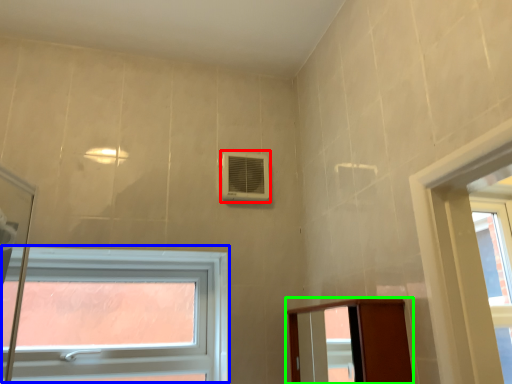
Question: Based on their relative distances, which object is nearer to air conditioning (highlighted by a red box)? Choose from window (highlighted by a blue box) and elevator (highlighted by a green box).

Choices:
 (A) window
 (B) elevator

Answer: (A)